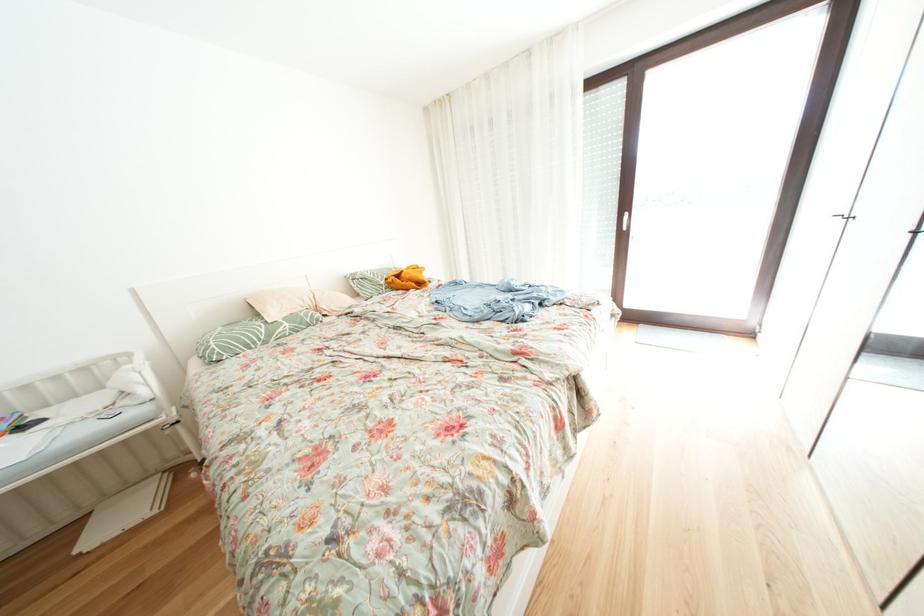
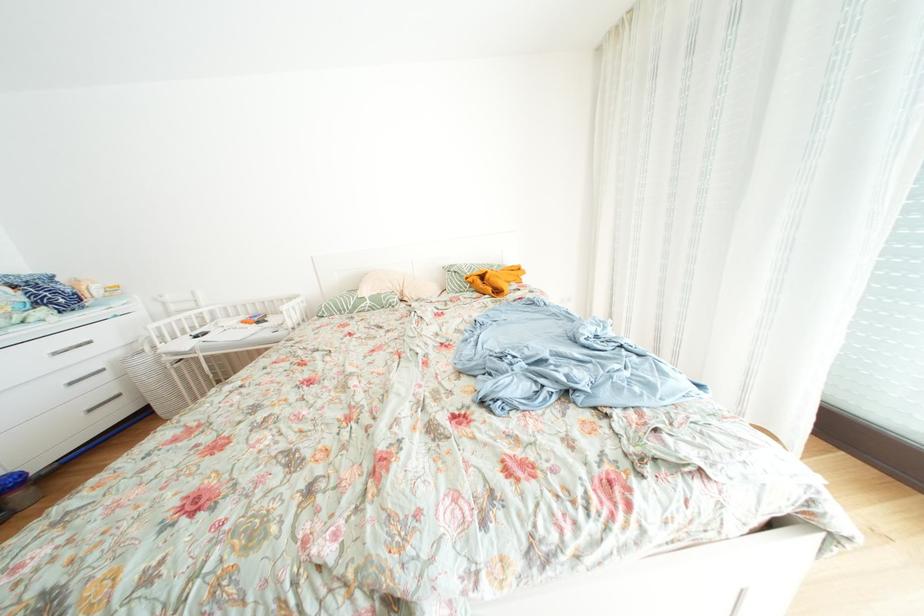
Question: How did the camera likely rotate?

Choices:
 (A) Left
 (B) Right
 (C) Up
 (D) Down

Answer: (A)